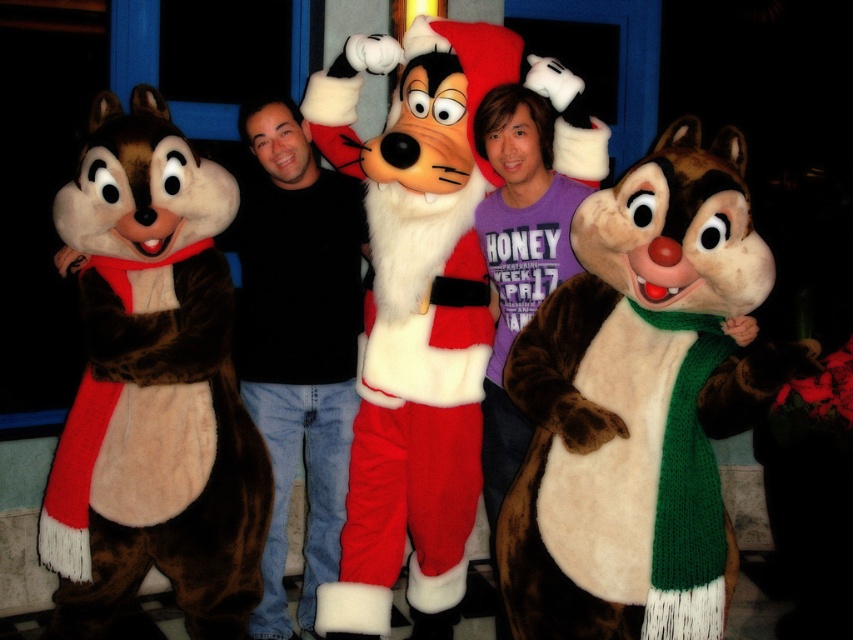
Can you confirm if brown furry chipmunk at center is positioned to the left of brown furry chipmunk at left?

Incorrect, brown furry chipmunk at center is not on the left side of brown furry chipmunk at left.

Is brown furry chipmunk at center wider than brown furry chipmunk at left?

Indeed, brown furry chipmunk at center has a greater width compared to brown furry chipmunk at left.

Does point (708, 381) lie behind point (78, 211)?

No, (708, 381) is in front of (78, 211).

This screenshot has width=853, height=640. I want to click on brown furry chipmunk at center, so click(x=640, y=403).

In the scene shown: Who is more forward, (138, 358) or (328, 362)?

Point (138, 358) is more forward.

Based on the photo, which is more to the right, brown furry chipmunk at left or black cotton shirt at center?

From the viewer's perspective, black cotton shirt at center appears more on the right side.

Which is behind, point (151, 531) or point (341, 468)?

The point (341, 468) is more distant.

This screenshot has width=853, height=640. In order to click on brown furry chipmunk at left in this screenshot , I will do `click(155, 387)`.

Between brown furry chipmunk at center and black cotton shirt at center, which one is positioned lower?

brown furry chipmunk at center is lower down.

Is brown furry chipmunk at center positioned behind black cotton shirt at center?

That is False.

What do you see at coordinates (640, 403) in the screenshot?
I see `brown furry chipmunk at center` at bounding box center [640, 403].

In order to click on brown furry chipmunk at center in this screenshot , I will do `click(640, 403)`.